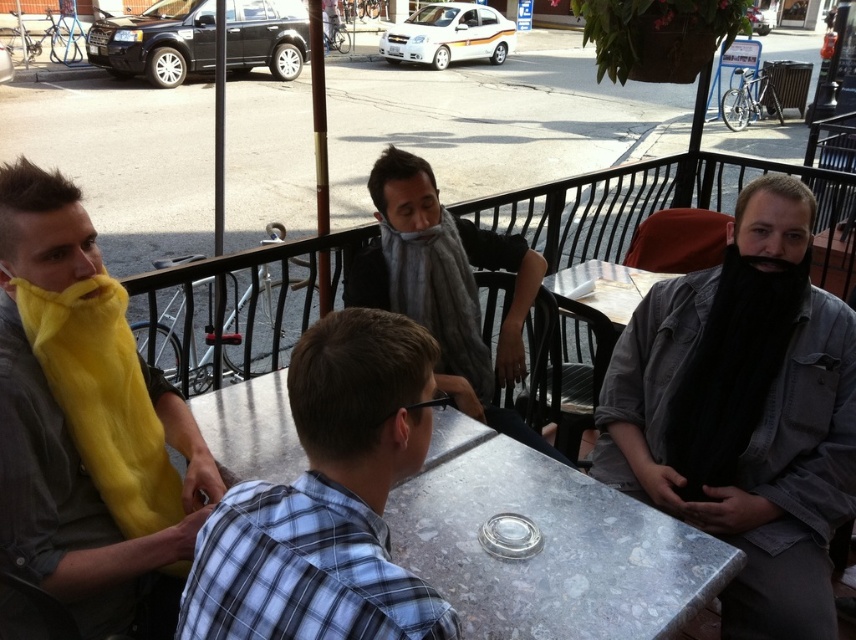
How distant is metallic gray table at center from plaid shirt at center?

The distance of metallic gray table at center from plaid shirt at center is 17.90 inches.

Who is more forward, (x=608, y=499) or (x=304, y=560)?

Point (x=304, y=560) is more forward.

Image resolution: width=856 pixels, height=640 pixels. I want to click on metallic gray table at center, so click(x=547, y=545).

The height and width of the screenshot is (640, 856). Find the location of `yellow fuzzy scarf at left`. yellow fuzzy scarf at left is located at coordinates (87, 436).

Is yellow fuzzy scarf at left behind metallic gray table at center?

That is True.

Which is in front, point (13, 416) or point (704, 584)?

Positioned in front is point (13, 416).

The width and height of the screenshot is (856, 640). Identify the location of yellow fuzzy scarf at left. (87, 436).

Can you confirm if black matte beard at right is positioned above metallic gray table at center?

Yes, black matte beard at right is above metallic gray table at center.

The image size is (856, 640). I want to click on black matte beard at right, so coord(744,412).

Which is behind, point (736, 204) or point (477, 541)?

Point (736, 204)

The image size is (856, 640). Find the location of `black matte beard at right`. black matte beard at right is located at coordinates (744, 412).